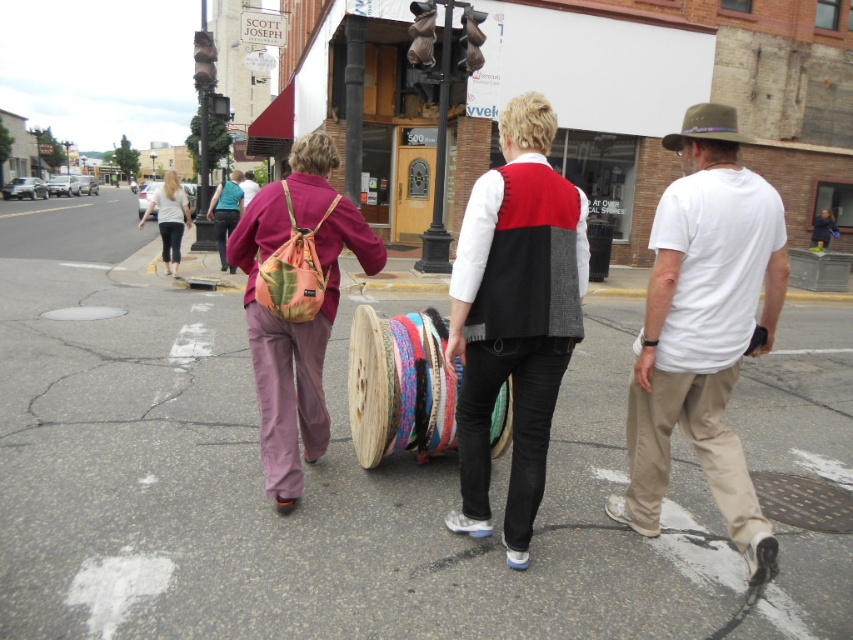
Question: Is red and black sweater vest at center behind floral fabric backpack at center?

Choices:
 (A) no
 (B) yes

Answer: (A)

Question: Can you confirm if red and black sweater vest at center is bigger than teal fabric shirt at center?

Choices:
 (A) yes
 (B) no

Answer: (B)

Question: Which point is closer to the camera taking this photo?

Choices:
 (A) (368, 236)
 (B) (223, 200)

Answer: (A)

Question: Which of the following is the farthest from the observer?

Choices:
 (A) (270, 397)
 (B) (160, 204)

Answer: (B)

Question: In this image, where is white cotton t-shirt at center located relative to teal fabric shirt at center?

Choices:
 (A) left
 (B) right

Answer: (B)

Question: Which point is closer to the camera?

Choices:
 (A) floral fabric backpack at center
 (B) light beige cotton shirt at upper left
 (C) white cotton t-shirt at center
 (D) gray asphalt road at center

Answer: (D)